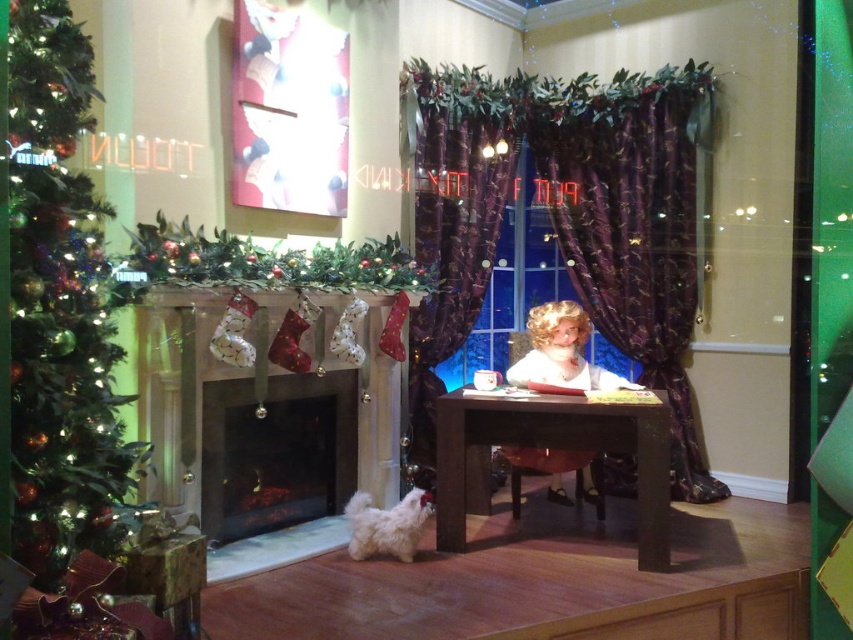
Question: Observing the image, what is the correct spatial positioning of green textured christmas tree at left in reference to purple velvet curtains at center?

Choices:
 (A) below
 (B) above

Answer: (A)

Question: Which of these objects is positioned farthest from the smooth blonde wig at center?

Choices:
 (A) black glass fireplace at lower left
 (B) purple satin curtains at center

Answer: (A)

Question: Can you confirm if purple satin curtains at center is bigger than brown wooden table at center?

Choices:
 (A) no
 (B) yes

Answer: (B)

Question: Which of these objects is positioned closest to the black glass fireplace at lower left?

Choices:
 (A) brown wooden table at center
 (B) green textured christmas tree at left

Answer: (A)

Question: In this image, where is black glass fireplace at lower left located relative to brown wooden table at center?

Choices:
 (A) left
 (B) right

Answer: (A)

Question: Which object is the closest to the black glass fireplace at lower left?

Choices:
 (A) purple velvet curtains at center
 (B) smooth blonde wig at center
 (C) brown wooden table at center

Answer: (C)